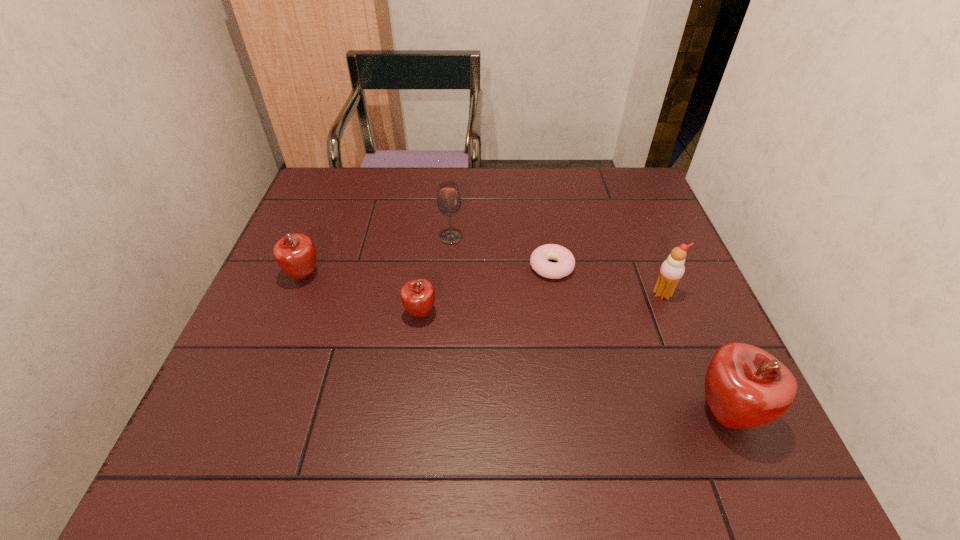
Where is `object at the near right corner`? object at the near right corner is located at coordinates (745, 386).

At what (x,y) coordinates should I click in order to perform the action: click on vacant space at the far edge of the desktop. Please return your answer as a coordinate pair (x, y). Looking at the image, I should click on (500, 177).

Locate an element on the screen. The width and height of the screenshot is (960, 540). vacant space at the left edge of the desktop is located at coordinates pyautogui.click(x=254, y=378).

In the image, there is a desktop. At what (x,y) coordinates should I click in order to perform the action: click on vacant space at the right edge. Please return your answer as a coordinate pair (x, y). The image size is (960, 540). Looking at the image, I should click on (631, 250).

You are a GUI agent. You are given a task and a screenshot of the screen. Output one action in this format:
    pyautogui.click(x=<x>, y=<y>)
    Task: Click on the vacant region at the far left corner of the desktop
    This screenshot has height=540, width=960.
    Given the screenshot: What is the action you would take?
    pyautogui.click(x=346, y=199)

Identify the location of free space at the far right corner. The height and width of the screenshot is (540, 960). (648, 191).

The image size is (960, 540). In order to click on vacant space that is in between the doughnut and the second farthest apple in this screenshot , I will do `click(486, 290)`.

Locate an element on the screen. This screenshot has width=960, height=540. free space between the second shortest apple and the fifth tallest object is located at coordinates (363, 294).

This screenshot has width=960, height=540. In order to click on vacant area that lies between the fourth object from left to right and the second apple from right to left in this screenshot , I will do `click(486, 290)`.

Identify the location of vacant space that's between the rightmost apple and the shortest apple. The height and width of the screenshot is (540, 960). (573, 363).